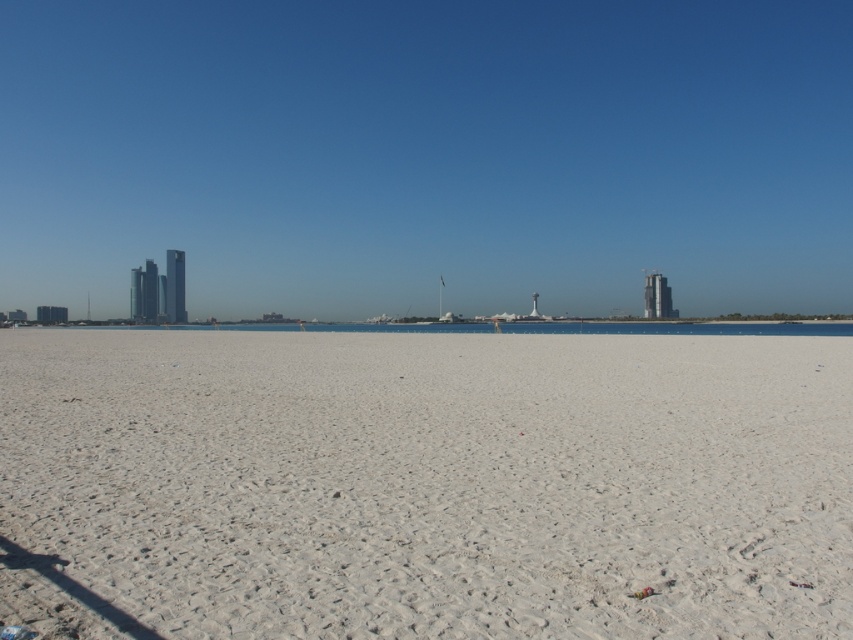
Question: Which point is closer to the camera?

Choices:
 (A) (428, 636)
 (B) (697, 330)

Answer: (A)

Question: Is white sandy beach at center to the right of clear blue water at center from the viewer's perspective?

Choices:
 (A) no
 (B) yes

Answer: (B)

Question: Is white sandy beach at center thinner than clear blue water at center?

Choices:
 (A) no
 (B) yes

Answer: (B)

Question: Can you confirm if white sandy beach at center is bigger than clear blue water at center?

Choices:
 (A) yes
 (B) no

Answer: (B)